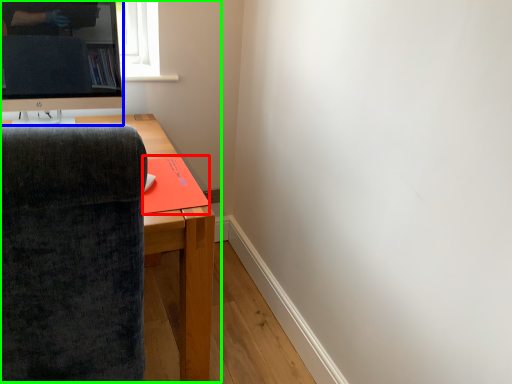
Question: Which object is positioned farthest from book (highlighted by a red box)? Select from television (highlighted by a blue box) and entertainment center (highlighted by a green box).

Choices:
 (A) television
 (B) entertainment center

Answer: (A)